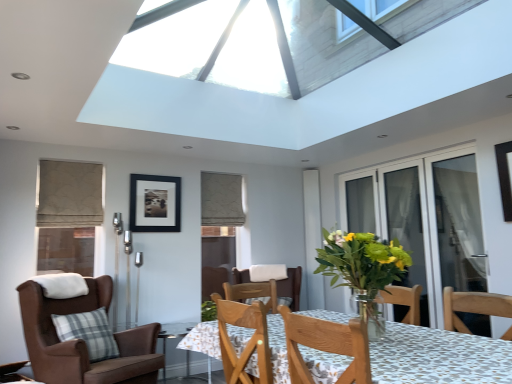
Question: Would you say transparent glass screen door at right, acting as the first screen door starting from the back, is to the left or to the right of transparent glass table at lower center in the picture?

Choices:
 (A) right
 (B) left

Answer: (A)

Question: From the image's perspective, is transparent glass screen door at right, the second screen door when ordered from front to back, located above or below transparent glass table at lower center?

Choices:
 (A) below
 (B) above

Answer: (B)

Question: Which object is positioned farthest from the transparent glass door at right, placed as the 2th screen door when sorted from back to front?

Choices:
 (A) translucent glass vase at center
 (B) black matte picture frame at upper center
 (C) transparent glass screen door at right, the second screen door when ordered from front to back
 (D) patterned fabric table at center
 (E) brown leather chair at left

Answer: (E)

Question: Which of these objects is positioned farthest from the black matte picture frame at upper center?

Choices:
 (A) transparent glass table at lower center
 (B) translucent glass vase at center
 (C) transparent glass door at right, the 1th screen door positioned from the front
 (D) beige textured curtain at upper center
 (E) patterned fabric table at center

Answer: (E)